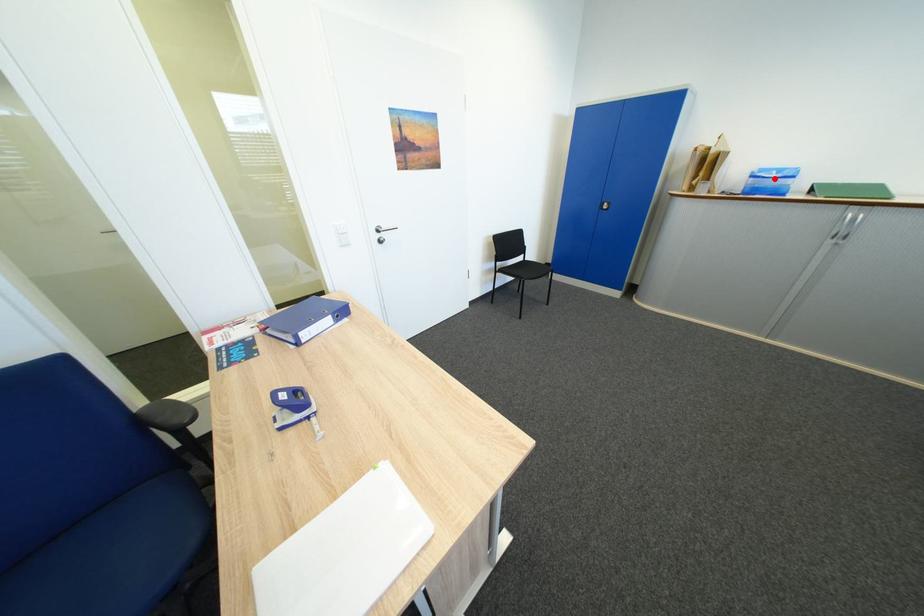
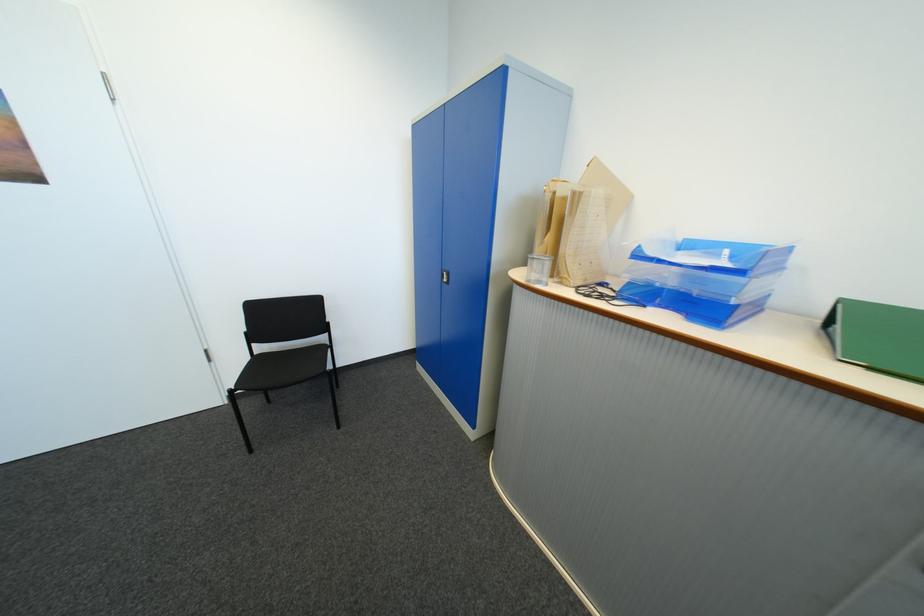
Where in the second image is the point corresponding to the highlighted location from the first image?

(671, 262)